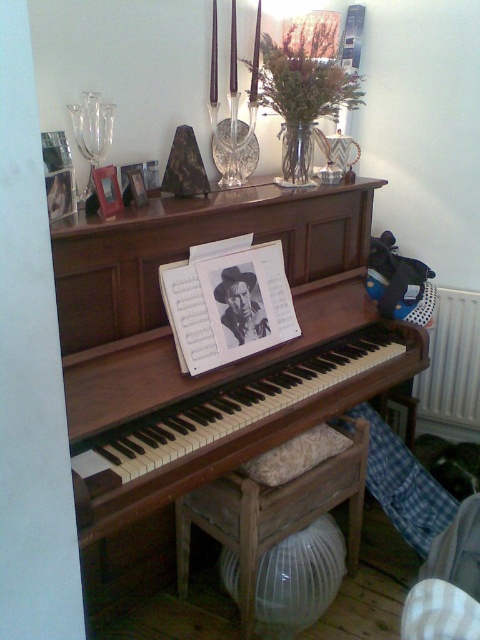
Question: Which of the following is the farthest from the observer?

Choices:
 (A) wooden piano at center
 (B) matte wooden picture frame at upper left

Answer: (B)

Question: Can you confirm if white plastic radiator at right is thinner than matte wooden picture frame at upper left?

Choices:
 (A) yes
 (B) no

Answer: (B)

Question: Does white plastic radiator at right lie behind matte wooden picture frame at upper center?

Choices:
 (A) yes
 (B) no

Answer: (A)

Question: Where is wooden piano at center located in relation to white plastic radiator at right in the image?

Choices:
 (A) above
 (B) below

Answer: (A)

Question: Which object appears farthest from the camera in this image?

Choices:
 (A) matte wooden picture frame at upper left
 (B) wooden piano at center

Answer: (A)

Question: Which object is farther from the camera taking this photo?

Choices:
 (A) white plastic radiator at right
 (B) matte wooden picture frame at upper center

Answer: (A)